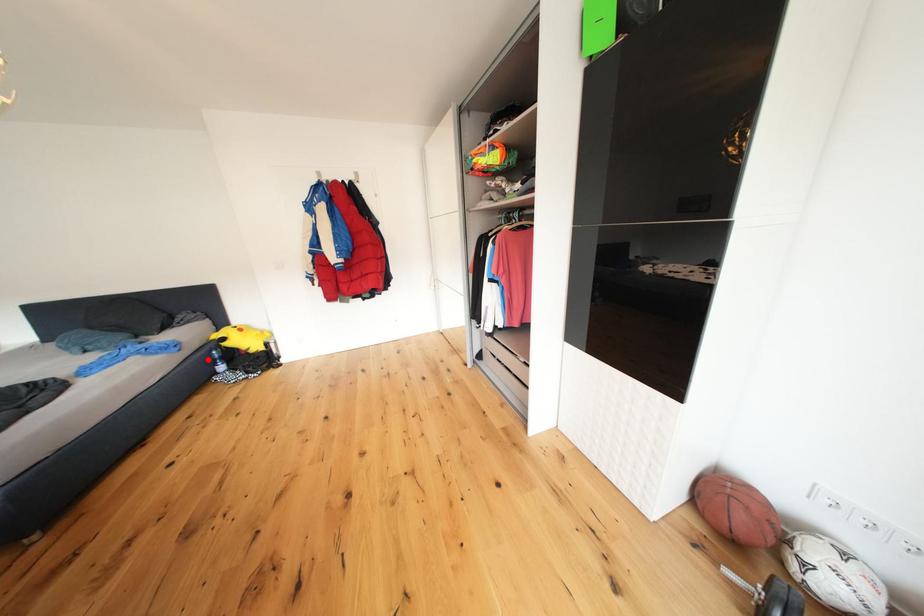
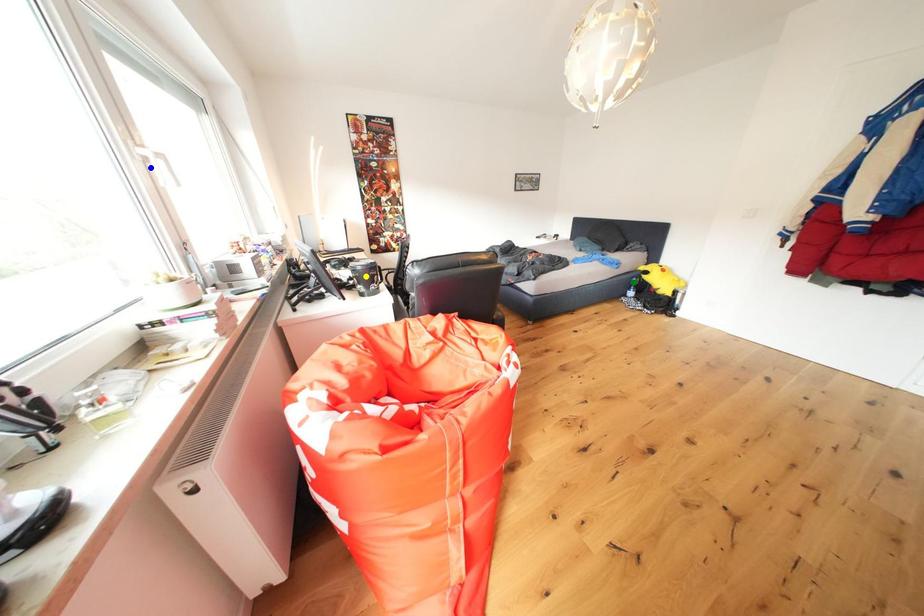
Question: I am providing you with two images of the same scene from different viewpoints. A red point is marked on the first image. You are given multiple points on the second image. Which spot in image 2 lines up with the point in image 1?

Choices:
 (A) green point
 (B) yellow point
 (C) blue point

Answer: (A)